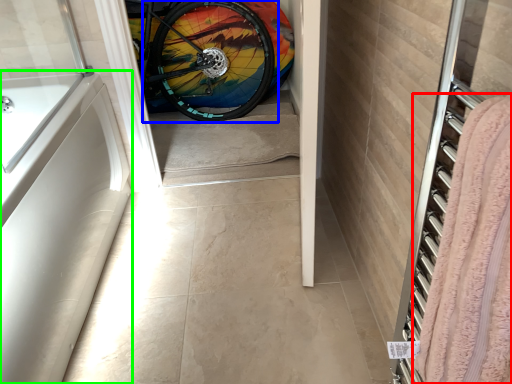
Question: Which object is positioned closest to blanket (highlighted by a red box)? Select from bicycle wheel (highlighted by a blue box) and bath (highlighted by a green box).

Choices:
 (A) bicycle wheel
 (B) bath

Answer: (B)